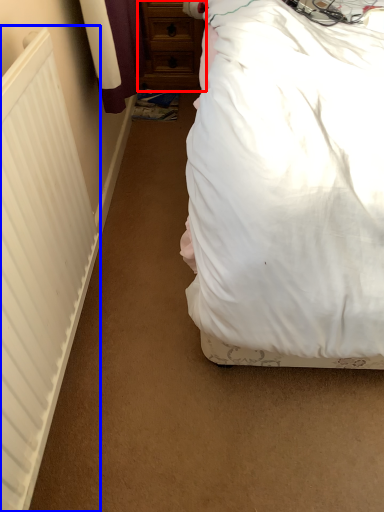
Question: Which object is closer to the camera taking this photo, chest of drawers (highlighted by a red box) or radiator (highlighted by a blue box)?

Choices:
 (A) chest of drawers
 (B) radiator

Answer: (B)